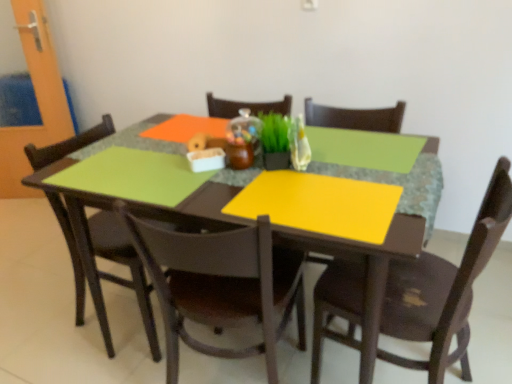
The width and height of the screenshot is (512, 384). What do you see at coordinates (37, 101) in the screenshot?
I see `orange matte glass door at left` at bounding box center [37, 101].

Describe the element at coordinates (275, 132) in the screenshot. I see `green matte plant at center` at that location.

The width and height of the screenshot is (512, 384). What do you see at coordinates (355, 117) in the screenshot?
I see `yellow matte placemat at center` at bounding box center [355, 117].

Measure the distance between point (x=312, y=121) and camera.

Point (x=312, y=121) is 1.76 meters away from camera.

Find the location of a particular element. matte brown chair at center, which is counted as the 2th chair, starting from the right is located at coordinates (220, 284).

The width and height of the screenshot is (512, 384). Identify the location of orange matte glass door at left. (37, 101).

Does yellow matte placemat at center have a smaller size compared to green matte plant at center?

Actually, yellow matte placemat at center might be larger than green matte plant at center.

From the image's perspective, is yellow matte placemat at center located above or below green matte plant at center?

yellow matte placemat at center is below green matte plant at center.

Can you confirm if yellow matte placemat at center is taller than green matte plant at center?

Yes.

Looking at the image, does matte wooden table at center seem bigger or smaller compared to orange matte glass door at left?

Clearly, matte wooden table at center is larger in size than orange matte glass door at left.

Which object is positioned more to the left, matte wooden table at center or orange matte glass door at left?

orange matte glass door at left.

Based on the photo, which is less distant, (365, 331) or (44, 130)?

Positioned in front is point (365, 331).

Considering the positions of point (288, 149) and point (108, 202), is point (288, 149) closer or farther from the camera than point (108, 202)?

Point (288, 149) is farther from the camera than point (108, 202).

From a real-world perspective, which object rests below the other?

matte wooden table at center is physically lower.

Does green matte plant at center turn towards matte wooden table at center?

No, green matte plant at center is not oriented towards matte wooden table at center.

Are green matte plant at center and matte wooden table at center making contact?

green matte plant at center and matte wooden table at center are not in contact.

From the image's perspective, count 1st chairs downward from the orange matte glass door at left and point to it. Please provide its 2D coordinates.

[(123, 264)]

Which object is thinner, orange matte glass door at left or matte brown chair at left, the 1th chair positioned from the left?

orange matte glass door at left is thinner.

From the image's perspective, is orange matte glass door at left on top of matte brown chair at left, the 1th chair positioned from the left?

Indeed, from the image's perspective, orange matte glass door at left is shown above matte brown chair at left, the 1th chair positioned from the left.

Is orange matte glass door at left aimed at matte brown chair at left, the 1th chair positioned from the left?

No, orange matte glass door at left is not oriented towards matte brown chair at left, the 1th chair positioned from the left.

Are matte brown chair at left, which ranks as the third chair in right-to-left order, and matte brown chair at center, which ranks as the second chair in left-to-right order, located far from each other?

No, matte brown chair at left, which ranks as the third chair in right-to-left order, is in close proximity to matte brown chair at center, which ranks as the second chair in left-to-right order.

Does point (133, 266) come closer to viewer compared to point (290, 261)?

No.

Considering the positions of objects matte brown chair at left, the 1th chair positioned from the left, and matte brown chair at center, which ranks as the second chair in left-to-right order, in the image provided, who is in front, matte brown chair at left, the 1th chair positioned from the left, or matte brown chair at center, which ranks as the second chair in left-to-right order,?

matte brown chair at center, which ranks as the second chair in left-to-right order.

How different are the orientations of matte brown chair at left, which ranks as the third chair in right-to-left order, and matte brown chair at center, which ranks as the second chair in left-to-right order, in degrees?

There is a 102-degree angle between the facing directions of matte brown chair at left, which ranks as the third chair in right-to-left order, and matte brown chair at center, which ranks as the second chair in left-to-right order.

Is wooden chair at lower right, acting as the third chair starting from the left, placed right next to orange matte glass door at left?

No.

From the picture: Is wooden chair at lower right, acting as the first chair starting from the right, closer to camera compared to orange matte glass door at left?

Yes, it is in front of orange matte glass door at left.

Considering the relative sizes of wooden chair at lower right, acting as the first chair starting from the right, and orange matte glass door at left in the image provided, is wooden chair at lower right, acting as the first chair starting from the right, shorter than orange matte glass door at left?

Correct, wooden chair at lower right, acting as the first chair starting from the right, is not as tall as orange matte glass door at left.

How different are the orientations of wooden chair at lower right, acting as the third chair starting from the left, and orange matte glass door at left in degrees?

wooden chair at lower right, acting as the third chair starting from the left, and orange matte glass door at left are facing 121 degrees away from each other.

In terms of height, does orange matte glass door at left look taller or shorter compared to yellow matte placemat at center?

orange matte glass door at left is taller than yellow matte placemat at center.

From the picture: Can we say orange matte glass door at left lies outside yellow matte placemat at center?

orange matte glass door at left is positioned outside yellow matte placemat at center.

From the image's perspective, which is below, orange matte glass door at left or yellow matte placemat at center?

yellow matte placemat at center appears lower in the image.

Is orange matte glass door at left turned away from yellow matte placemat at center?

No, orange matte glass door at left's orientation is not away from yellow matte placemat at center.

This screenshot has width=512, height=384. I want to click on armchair that appears on the right of green matte plant at center, so click(x=355, y=117).

Locate an element on the screen. kitchen & dining room table located underneath the orange matte glass door at left (from a real-world perspective) is located at coordinates (129, 205).

Estimate the real-world distances between objects in this image. Which object is closer to green matte plant at center, matte brown chair at left, the 1th chair positioned from the left, or yellow matte placemat at center?

The object closer to green matte plant at center is yellow matte placemat at center.

Considering their positions, is matte brown chair at center, which ranks as the second chair in left-to-right order, positioned closer to wooden chair at lower right, acting as the first chair starting from the right, than orange matte glass door at left?

matte brown chair at center, which ranks as the second chair in left-to-right order, is positioned closer to the anchor wooden chair at lower right, acting as the first chair starting from the right.

Looking at the image, which one is located closer to matte brown chair at center, which ranks as the second chair in left-to-right order, matte brown chair at left, the 1th chair positioned from the left, or wooden chair at lower right, acting as the first chair starting from the right?

The object closer to matte brown chair at center, which ranks as the second chair in left-to-right order, is wooden chair at lower right, acting as the first chair starting from the right.

Looking at the image, which one is located closer to matte brown chair at center, which ranks as the second chair in left-to-right order, orange matte glass door at left or matte wooden table at center?

matte wooden table at center is positioned closer to the anchor matte brown chair at center, which ranks as the second chair in left-to-right order.

Which object lies nearer to the anchor point matte brown chair at left, the 1th chair positioned from the left, matte brown chair at center, which is counted as the 2th chair, starting from the right, or matte wooden table at center?

matte wooden table at center is closer to matte brown chair at left, the 1th chair positioned from the left.

When comparing their distances from green matte plant at center, does wooden chair at lower right, acting as the third chair starting from the left, or orange matte glass door at left seem further?

orange matte glass door at left lies further to green matte plant at center than the other object.

Based on the photo, when comparing their distances from matte brown chair at left, which ranks as the third chair in right-to-left order, does orange matte glass door at left or wooden chair at lower right, acting as the first chair starting from the right, seem closer?

Among the two, orange matte glass door at left is located nearer to matte brown chair at left, which ranks as the third chair in right-to-left order.

Which object lies further to the anchor point orange matte glass door at left, matte brown chair at left, the 1th chair positioned from the left, or wooden chair at lower right, acting as the first chair starting from the right?

wooden chair at lower right, acting as the first chair starting from the right, lies further to orange matte glass door at left than the other object.

Identify the location of plant between orange matte glass door at left and wooden chair at lower right, acting as the third chair starting from the left, from left to right. Image resolution: width=512 pixels, height=384 pixels. (275, 132).

Find the location of a particular element. kitchen & dining room table situated between matte brown chair at left, the 1th chair positioned from the left, and yellow matte placemat at center from left to right is located at coordinates (129, 205).

What are the coordinates of `chair between matte brown chair at left, which ranks as the third chair in right-to-left order, and yellow matte placemat at center from left to right` in the screenshot? It's located at (220, 284).

This screenshot has width=512, height=384. In order to click on kitchen & dining room table between wooden chair at lower right, acting as the third chair starting from the left, and yellow matte placemat at center, along the z-axis in this screenshot , I will do `click(129, 205)`.